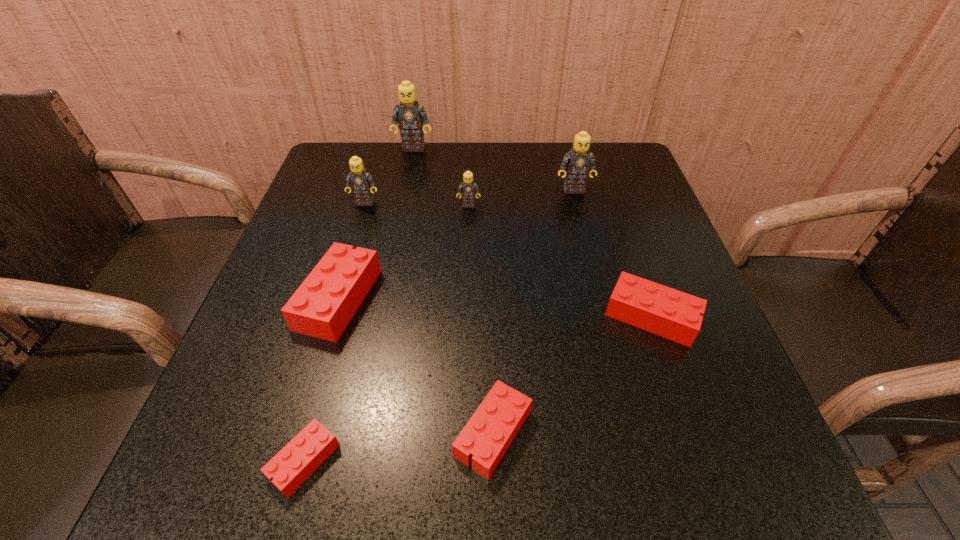
Locate an element on the screen. This screenshot has width=960, height=540. the rightmost red Lego is located at coordinates (664, 311).

What are the coordinates of `the third shortest object` in the screenshot? It's located at (664, 311).

At what (x,y) coordinates should I click in order to perform the action: click on the third red Lego from left to right. Please return your answer as a coordinate pair (x, y). This screenshot has width=960, height=540. Looking at the image, I should click on (487, 435).

The height and width of the screenshot is (540, 960). Identify the location of the second shortest Lego. (487, 435).

Where is `the smallest red Lego`? The width and height of the screenshot is (960, 540). the smallest red Lego is located at coordinates (293, 464).

Where is `the shortest Lego`? The height and width of the screenshot is (540, 960). the shortest Lego is located at coordinates (293, 464).

At what (x,y) coordinates should I click in order to perform the action: click on vacant space located 0.110m in front of the farthest object. Please return your answer as a coordinate pair (x, y). Looking at the image, I should click on (408, 174).

At what (x,y) coordinates should I click in order to perform the action: click on free space located 0.390m in front of the third nearest tan Lego. Please return your answer as a coordinate pair (x, y). Image resolution: width=960 pixels, height=540 pixels. Looking at the image, I should click on (607, 321).

At what (x,y) coordinates should I click in order to perform the action: click on vacant space located 0.340m in front of the second smallest tan Lego. Please return your answer as a coordinate pair (x, y). Looking at the image, I should click on (329, 321).

At what (x,y) coordinates should I click in order to perform the action: click on vacant space positioned in front of the third tan Lego from left to right. Please return your answer as a coordinate pair (x, y). Image resolution: width=960 pixels, height=540 pixels. Looking at the image, I should click on (466, 299).